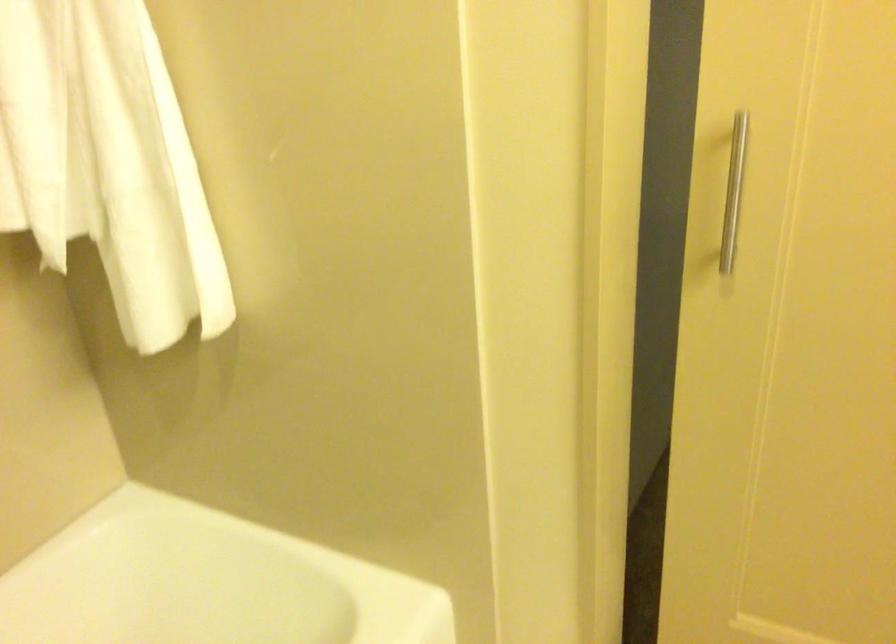
Describe the element at coordinates (734, 193) in the screenshot. I see `a silver door handle` at that location.